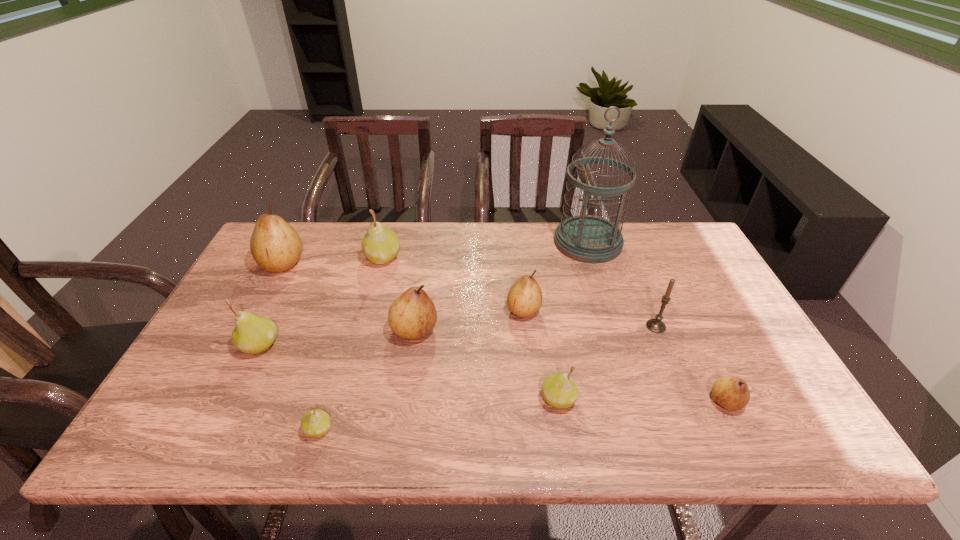
This screenshot has height=540, width=960. Find the location of `free region located on the back of the fifth pear from left to right`. free region located on the back of the fifth pear from left to right is located at coordinates (423, 269).

Locate an element on the screen. The image size is (960, 540). free space located on the back of the third smallest green pear is located at coordinates (305, 252).

Where is `vacant space located on the back of the third biggest brown pear`? The image size is (960, 540). vacant space located on the back of the third biggest brown pear is located at coordinates (516, 229).

Where is `free space located on the back of the third biggest green pear`? The height and width of the screenshot is (540, 960). free space located on the back of the third biggest green pear is located at coordinates (545, 314).

Where is `vacant position located on the left of the rightmost pear`? The height and width of the screenshot is (540, 960). vacant position located on the left of the rightmost pear is located at coordinates (652, 401).

Image resolution: width=960 pixels, height=540 pixels. In order to click on vacant space located on the right of the smallest green pear in this screenshot , I will do `click(509, 429)`.

Locate an element on the screen. Image resolution: width=960 pixels, height=540 pixels. birdcage located at the far edge is located at coordinates (586, 238).

Locate an element on the screen. The height and width of the screenshot is (540, 960). object at the right edge is located at coordinates (732, 393).

Where is `object that is at the far left corner`? object that is at the far left corner is located at coordinates (276, 247).

Locate an element on the screen. Image resolution: width=960 pixels, height=540 pixels. object present at the near right corner is located at coordinates (732, 393).